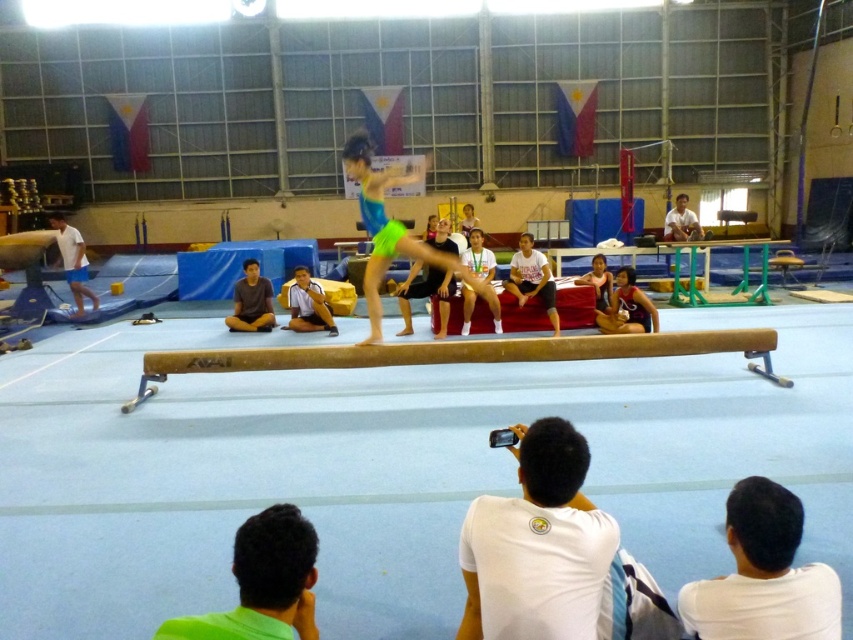
Question: Which object appears closest to the camera in this image?

Choices:
 (A) neon green fabric gymnast at center
 (B) light brown wooden table at upper right
 (C) green fabric shirt at lower left

Answer: (C)

Question: Is white matte shirt at lower center closer to camera compared to green fabric shirt at lower left?

Choices:
 (A) yes
 (B) no

Answer: (B)

Question: Which of the following is the closest to the observer?

Choices:
 (A) (601, 525)
 (B) (310, 328)
 (C) (341, 356)

Answer: (A)

Question: Which of the following is the closest to the observer?

Choices:
 (A) white matte shorts at left
 (B) neon green fabric gymnast at center

Answer: (B)

Question: Can you confirm if white cotton shirt at center is wider than white matte shorts at left?

Choices:
 (A) no
 (B) yes

Answer: (A)

Question: Is white matte shirt at lower center to the left of yellow matte balance beam at center from the viewer's perspective?

Choices:
 (A) no
 (B) yes

Answer: (A)